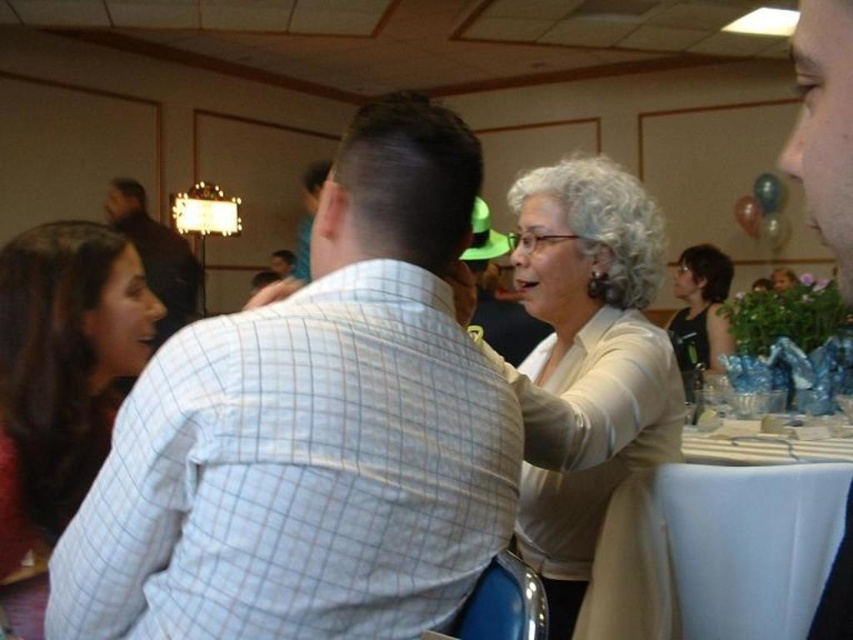
Is white silk blouse at center positioned at the back of black fabric tank top at right?

No, white silk blouse at center is closer to the viewer.

Where is `white silk blouse at center`? The width and height of the screenshot is (853, 640). white silk blouse at center is located at coordinates (595, 401).

Can you confirm if white silk blouse at center is bigger than matte white shirt at upper left?

No, white silk blouse at center is not bigger than matte white shirt at upper left.

Is white silk blouse at center behind matte white shirt at upper left?

No, it is in front of matte white shirt at upper left.

The width and height of the screenshot is (853, 640). What do you see at coordinates (595, 401) in the screenshot?
I see `white silk blouse at center` at bounding box center [595, 401].

Where is `white silk blouse at center`? white silk blouse at center is located at coordinates (595, 401).

The height and width of the screenshot is (640, 853). What do you see at coordinates (753, 534) in the screenshot?
I see `white cloth at lower right` at bounding box center [753, 534].

Where is `white cloth at lower right`? This screenshot has width=853, height=640. white cloth at lower right is located at coordinates (753, 534).

Between point (756, 556) and point (172, 308), which one is positioned in front?

Point (756, 556)

Identify the location of white cloth at lower right. Image resolution: width=853 pixels, height=640 pixels. (753, 534).